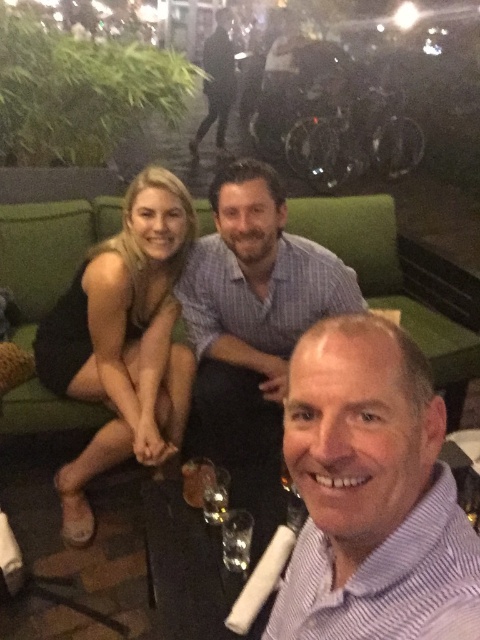
Based on the photo, does purple striped shirt at center appear on the right side of striped cotton shirt at center?

Correct, you'll find purple striped shirt at center to the right of striped cotton shirt at center.

Which is below, purple striped shirt at center or striped cotton shirt at center?

Positioned lower is purple striped shirt at center.

Is point (358, 390) closer to camera compared to point (201, 321)?

Yes, point (358, 390) is in front of point (201, 321).

The width and height of the screenshot is (480, 640). Find the location of `purple striped shirt at center`. purple striped shirt at center is located at coordinates (372, 493).

Is purple striped shirt at center closer to camera compared to transparent glass at lower center?

Yes, purple striped shirt at center is closer to the viewer.

Is purple striped shirt at center smaller than transparent glass at lower center?

No.

The width and height of the screenshot is (480, 640). Describe the element at coordinates (372, 493) in the screenshot. I see `purple striped shirt at center` at that location.

Locate an element on the screen. purple striped shirt at center is located at coordinates (372, 493).

Who is more distant from viewer, (245, 525) or (223, 502)?

Point (223, 502)

How distant is clear glass wine glass at lower center from transparent glass at lower center?

clear glass wine glass at lower center is 3.54 inches away from transparent glass at lower center.

Does point (231, 557) come in front of point (227, 470)?

Yes, it is.

You are a GUI agent. You are given a task and a screenshot of the screen. Output one action in this format:
    pyautogui.click(x=<x>, y=<y>)
    Task: Click on the clear glass wine glass at lower center
    Image resolution: width=480 pixels, height=640 pixels.
    Given the screenshot: What is the action you would take?
    pyautogui.click(x=237, y=540)